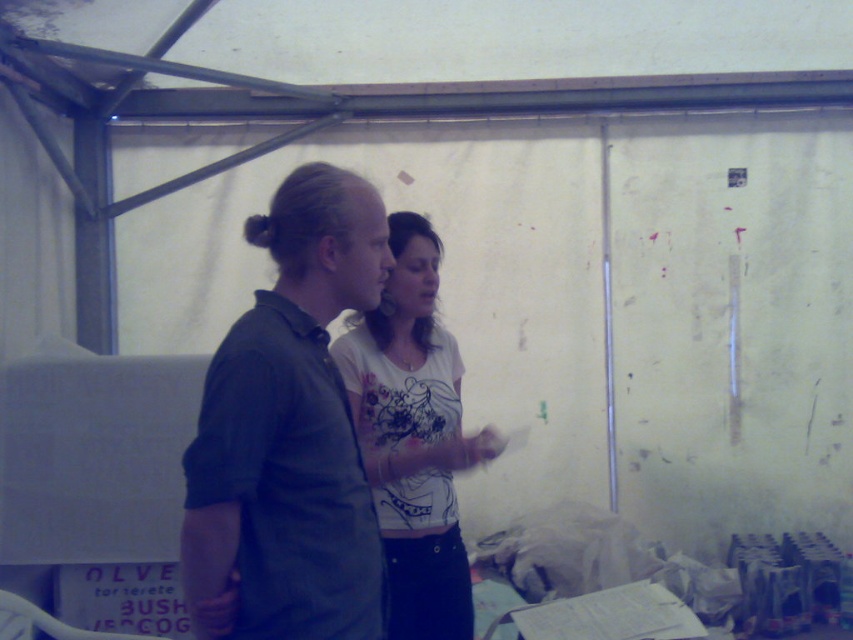
The width and height of the screenshot is (853, 640). Describe the element at coordinates (288, 433) in the screenshot. I see `dark green shirt at center` at that location.

At what (x,y) coordinates should I click in order to perform the action: click on dark green shirt at center. Please return your answer as a coordinate pair (x, y). This screenshot has height=640, width=853. Looking at the image, I should click on (288, 433).